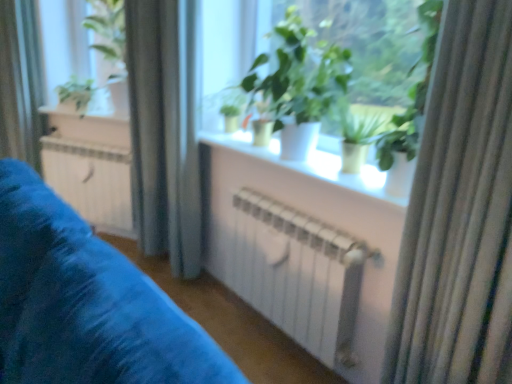
Question: Should I look upward or downward to see silky beige curtain at right, which is counted as the first curtain, starting from the right?

Choices:
 (A) down
 (B) up

Answer: (A)

Question: Is green matte plant at center, the first houseplant viewed from the front, next to green matte plant at center, marked as the 2th houseplant in a back-to-front arrangement?

Choices:
 (A) no
 (B) yes

Answer: (A)

Question: Could you tell me if green matte plant at center, which is the second houseplant in right-to-left order, is turned towards green matte plant at center, marked as the 2th houseplant in a back-to-front arrangement?

Choices:
 (A) no
 (B) yes

Answer: (A)

Question: Is green matte plant at center, which is the second houseplant in right-to-left order, located outside green matte plant at center, which is the 2th houseplant from front to back?

Choices:
 (A) no
 (B) yes

Answer: (B)

Question: Considering the relative sizes of green matte plant at center, marked as the 3th houseplant in a back-to-front arrangement, and green matte plant at center, marked as the 2th houseplant in a back-to-front arrangement, in the image provided, is green matte plant at center, marked as the 3th houseplant in a back-to-front arrangement, bigger than green matte plant at center, marked as the 2th houseplant in a back-to-front arrangement,?

Choices:
 (A) no
 (B) yes

Answer: (B)

Question: Can you confirm if green matte plant at center, the first houseplant viewed from the front, is shorter than green matte plant at center, which is the 2th houseplant from front to back?

Choices:
 (A) yes
 (B) no

Answer: (B)

Question: Does green matte plant at center, marked as the 3th houseplant in a back-to-front arrangement, have a smaller size compared to green matte plant at center, marked as the 2th houseplant in a back-to-front arrangement?

Choices:
 (A) yes
 (B) no

Answer: (B)

Question: From the image's perspective, is white matte window sill at center, marked as the second window sill in a back-to-front arrangement, under white metallic radiator at center?

Choices:
 (A) yes
 (B) no

Answer: (B)

Question: Is the position of white matte window sill at center, marked as the 2th window sill in a left-to-right arrangement, more distant than that of white metallic radiator at center?

Choices:
 (A) yes
 (B) no

Answer: (B)

Question: Would you consider white matte window sill at center, which is the second window sill in top-to-bottom order, to be distant from white metallic radiator at center?

Choices:
 (A) no
 (B) yes

Answer: (B)

Question: Considering the relative sizes of white matte window sill at center, which is the second window sill in top-to-bottom order, and white metallic radiator at center in the image provided, is white matte window sill at center, which is the second window sill in top-to-bottom order, smaller than white metallic radiator at center?

Choices:
 (A) yes
 (B) no

Answer: (A)

Question: From a real-world perspective, does white matte window sill at center, marked as the 2th window sill in a left-to-right arrangement, sit lower than white metallic radiator at center?

Choices:
 (A) no
 (B) yes

Answer: (A)

Question: Is white matte window sill at center, marked as the second window sill in a back-to-front arrangement, thinner than white metallic radiator at center?

Choices:
 (A) no
 (B) yes

Answer: (A)

Question: Would you say white metallic radiator at center contains green matte plant at center, positioned as the third houseplant in left-to-right order?

Choices:
 (A) no
 (B) yes

Answer: (A)